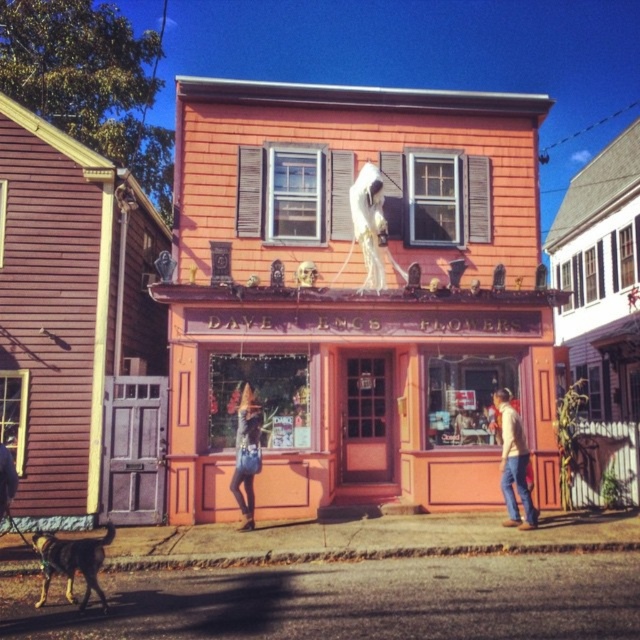
Locate an element on the screen. black fur dog at lower left is located at coordinates (72, 563).

Is black fur dog at lower left wider than denim jacket at center?

Yes, black fur dog at lower left is wider than denim jacket at center.

Who is more forward, (52, 573) or (259, 468)?

Point (52, 573) is in front.

This screenshot has height=640, width=640. Find the location of `black fur dog at lower left`. black fur dog at lower left is located at coordinates (72, 563).

Can you confirm if matte pink building at center is positioned below denim jacket at center?

No.

Looking at this image, which is below, matte pink building at center or denim jacket at center?

Positioned lower is denim jacket at center.

Which is in front, point (536, 410) or point (253, 444)?

Point (253, 444) is in front.

Locate an element on the screen. The width and height of the screenshot is (640, 640). matte pink building at center is located at coordinates (353, 392).

Is black fur dog at lower left positioned behind light brown leather jacket at lower right?

That is False.

Can you confirm if black fur dog at lower left is smaller than light brown leather jacket at lower right?

Yes.

Does point (65, 561) come closer to viewer compared to point (506, 412)?

Yes, point (65, 561) is closer to viewer.

This screenshot has height=640, width=640. I want to click on black fur dog at lower left, so click(72, 563).